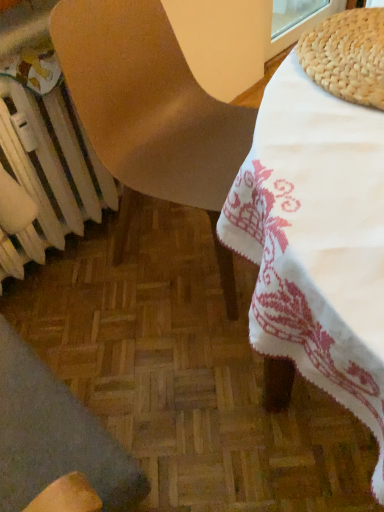
Question: From a real-world perspective, is matte brown chair at center, which is the 2th chair from bottom to top, below wooden chair at lower left, which appears as the first chair when ordered from the bottom?

Choices:
 (A) yes
 (B) no

Answer: (B)

Question: Does matte brown chair at center, which is the 2th chair from bottom to top, have a lesser height compared to wooden chair at lower left, acting as the second chair starting from the top?

Choices:
 (A) no
 (B) yes

Answer: (B)

Question: Is matte brown chair at center, which is the 2th chair from bottom to top, further to the viewer compared to wooden chair at lower left, which appears as the first chair when ordered from the bottom?

Choices:
 (A) no
 (B) yes

Answer: (B)

Question: Is wooden chair at lower left, which appears as the first chair when ordered from the bottom, located within matte brown chair at center, marked as the 1th chair in a top-to-bottom arrangement?

Choices:
 (A) yes
 (B) no

Answer: (B)

Question: Can you confirm if matte brown chair at center, which is the 2th chair from bottom to top, is smaller than wooden chair at lower left, which appears as the first chair when ordered from the bottom?

Choices:
 (A) no
 (B) yes

Answer: (A)

Question: Is point (66, 133) positioned closer to the camera than point (46, 462)?

Choices:
 (A) closer
 (B) farther

Answer: (B)

Question: Looking at the image, does white metallic radiator at lower left seem bigger or smaller compared to wooden chair at lower left, which appears as the first chair when ordered from the bottom?

Choices:
 (A) big
 (B) small

Answer: (B)

Question: Is white metallic radiator at lower left taller or shorter than wooden chair at lower left, which appears as the first chair when ordered from the bottom?

Choices:
 (A) tall
 (B) short

Answer: (B)

Question: Considering the relative positions of white metallic radiator at lower left and wooden chair at lower left, acting as the second chair starting from the top, in the image provided, is white metallic radiator at lower left to the left or to the right of wooden chair at lower left, acting as the second chair starting from the top,?

Choices:
 (A) right
 (B) left

Answer: (B)

Question: Would you say matte brown chair at center, marked as the 1th chair in a top-to-bottom arrangement, is to the left or to the right of wooden chair at lower left, which appears as the first chair when ordered from the bottom, in the picture?

Choices:
 (A) left
 (B) right

Answer: (B)

Question: Is point (130, 100) closer or farther from the camera than point (1, 381)?

Choices:
 (A) closer
 (B) farther

Answer: (B)

Question: From a real-world perspective, is matte brown chair at center, which is the 2th chair from bottom to top, physically located above or below wooden chair at lower left, which appears as the first chair when ordered from the bottom?

Choices:
 (A) below
 (B) above

Answer: (B)

Question: Considering the positions of matte brown chair at center, which is the 2th chair from bottom to top, and wooden chair at lower left, acting as the second chair starting from the top, in the image, is matte brown chair at center, which is the 2th chair from bottom to top, bigger or smaller than wooden chair at lower left, acting as the second chair starting from the top,?

Choices:
 (A) big
 (B) small

Answer: (A)

Question: From their relative heights in the image, would you say wooden chair at lower left, which appears as the first chair when ordered from the bottom, is taller or shorter than white metallic radiator at lower left?

Choices:
 (A) short
 (B) tall

Answer: (B)

Question: Considering the positions of point (39, 394) and point (16, 95), is point (39, 394) closer or farther from the camera than point (16, 95)?

Choices:
 (A) closer
 (B) farther

Answer: (A)